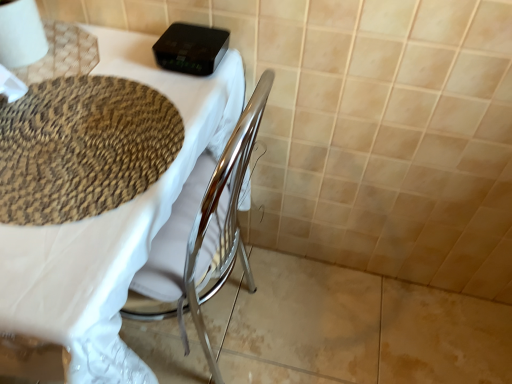
You are a GUI agent. You are given a task and a screenshot of the screen. Output one action in this format:
    pyautogui.click(x=<x>, y=<y>)
    Task: Click on the vacant area located to the right-hand side of white paper at upper left
    The image size is (512, 384).
    Given the screenshot: What is the action you would take?
    pyautogui.click(x=111, y=49)